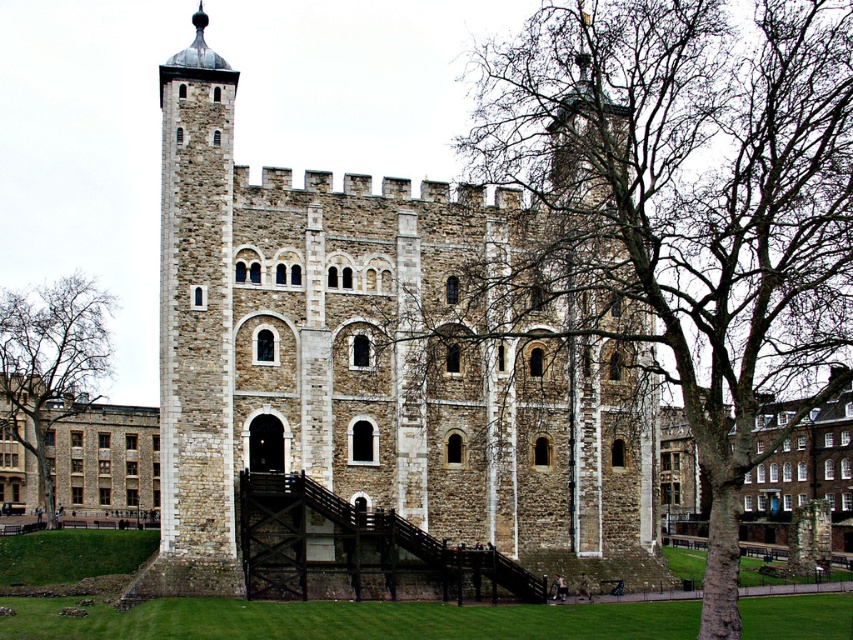
Is stone tower at center below stone tower at left?

Yes, stone tower at center is below stone tower at left.

Between point (416, 348) and point (213, 484), which one is positioned in front?

Point (213, 484) is more forward.

This screenshot has height=640, width=853. I want to click on stone tower at center, so click(369, 365).

Does bare wood tree at center have a greater width compared to stone tower at left?

→ Yes.

Does bare wood tree at center have a smaller size compared to stone tower at left?

No.

Is point (648, 328) positioned after point (178, 554)?

Yes.

Locate an element on the screen. The image size is (853, 640). bare wood tree at center is located at coordinates pos(689,205).

Between point (291, 396) and point (45, 428), which one is positioned behind?

The point (45, 428) is behind.

Between stone tower at center and bare branches at left, which one has more height?

stone tower at center

Which is in front, point (476, 461) or point (7, 420)?

Point (476, 461)

Locate an element on the screen. This screenshot has height=640, width=853. stone tower at center is located at coordinates (369, 365).